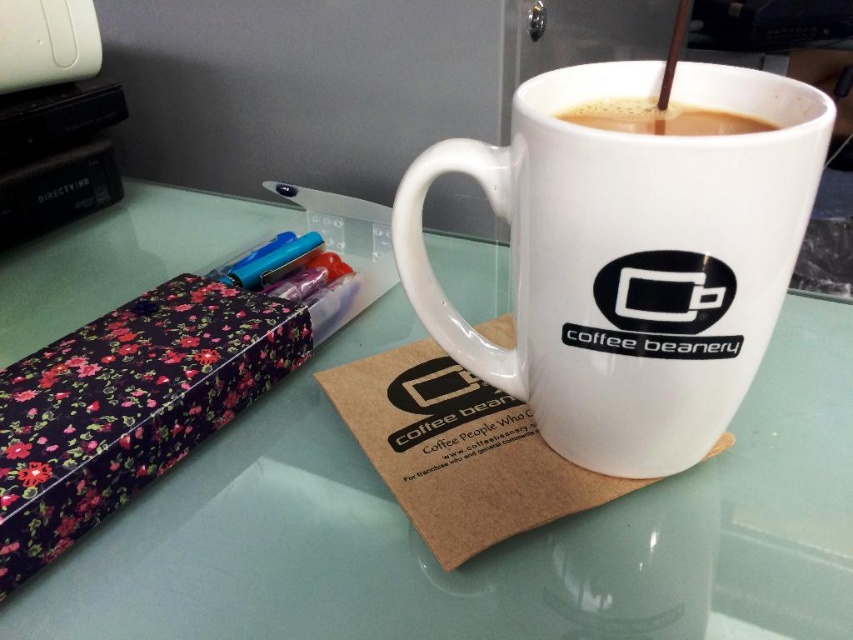
Question: Does transparent glass table at center appear on the left side of brown frothy coffee at upper center?

Choices:
 (A) yes
 (B) no

Answer: (A)

Question: Can you confirm if floral-patterned paper at left is thinner than matte plastic pen at upper left?

Choices:
 (A) yes
 (B) no

Answer: (B)

Question: Which point is farther to the camera?

Choices:
 (A) (68, 634)
 (B) (761, 234)
 (C) (85, 404)

Answer: (C)

Question: Which object appears closest to the camera in this image?

Choices:
 (A) transparent glass table at center
 (B) matte plastic pen at upper left

Answer: (A)

Question: In this image, where is white ceramic mug at center located relative to matte plastic pen at upper left?

Choices:
 (A) below
 (B) above

Answer: (A)

Question: Which object appears farthest from the camera in this image?

Choices:
 (A) floral-patterned paper at left
 (B) white ceramic mug at center
 (C) transparent glass table at center

Answer: (A)